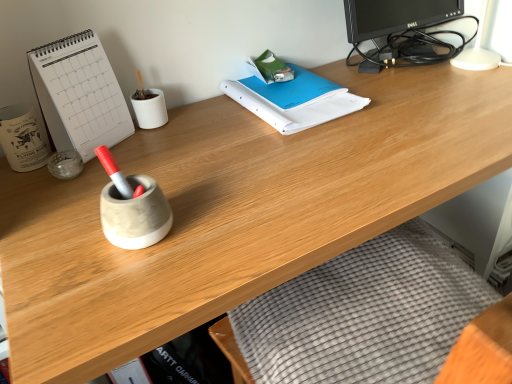
Locate an element on the screen. The height and width of the screenshot is (384, 512). vacant area that lies between blue paper binder at center and white ceramic mug at left, which appears as the second stationery when viewed from the right is located at coordinates (190, 137).